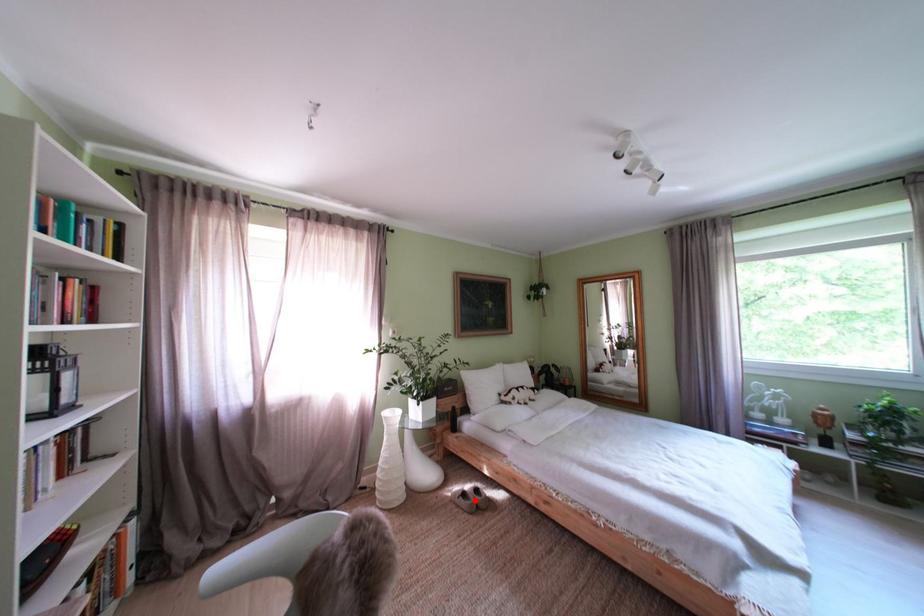
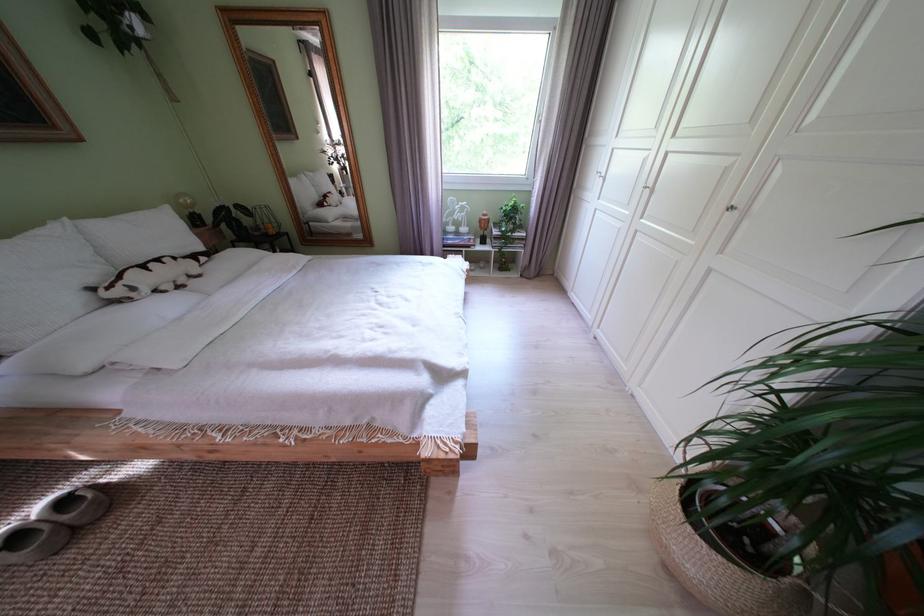
Question: I am providing you with two images of the same scene from different viewpoints. Given a red point in image1, look at the same physical point in image2. Is it:

Choices:
 (A) Closer to the viewpoint
 (B) Farther from the viewpoint

Answer: (A)